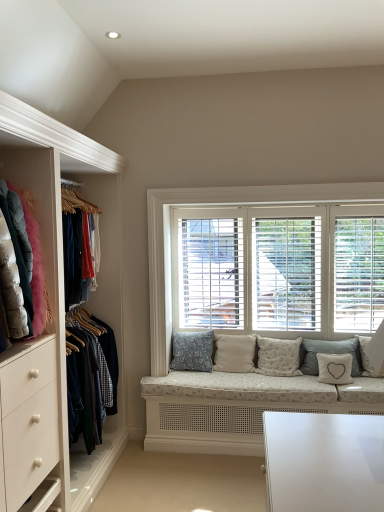
Find the location of `blue textured cushion at center, the first pillow when ordered from left to right`. blue textured cushion at center, the first pillow when ordered from left to right is located at coordinates (192, 351).

The image size is (384, 512). What do you see at coordinates (34, 262) in the screenshot?
I see `velvet jackets at left` at bounding box center [34, 262].

Measure the distance between point (318, 349) and camera.

3.45 meters.

This screenshot has height=512, width=384. What do you see at coordinates (330, 353) in the screenshot? I see `light gray fabric pillow at center, the fifth pillow in the left-to-right sequence` at bounding box center [330, 353].

What do you see at coordinates (335, 368) in the screenshot?
I see `white fabric pillow with heart design at lower right, the third pillow from the right` at bounding box center [335, 368].

You are a GUI agent. You are given a task and a screenshot of the screen. Output one action in this format:
    pyautogui.click(x=<x>, y=<y>)
    Task: Click on the blue textured cushion at center, the first pillow when ordered from left to right
    Image resolution: width=384 pixels, height=512 pixels.
    Given the screenshot: What is the action you would take?
    point(192,351)

Measure the distance between velvet jackets at left and white wood blinds at center.

velvet jackets at left and white wood blinds at center are 1.50 meters apart from each other.

In terms of size, does velvet jackets at left appear bigger or smaller than white wood blinds at center?

In the image, velvet jackets at left appears to be larger than white wood blinds at center.

Can you see velvet jackets at left touching white wood blinds at center?

There is a gap between velvet jackets at left and white wood blinds at center.

Locate an element on the screen. The height and width of the screenshot is (512, 384). the 2nd pillow counting from the right of the velvet jackets at left is located at coordinates (234, 353).

Is beige fabric cushion at center, which is the fifth pillow from right to left, to the left or to the right of velvet jackets at left in the image?

In the image, beige fabric cushion at center, which is the fifth pillow from right to left, appears on the right side of velvet jackets at left.

Consider the image. Considering the sizes of beige fabric cushion at center, which is the fifth pillow from right to left, and velvet jackets at left in the image, is beige fabric cushion at center, which is the fifth pillow from right to left, bigger or smaller than velvet jackets at left?

Considering their sizes, beige fabric cushion at center, which is the fifth pillow from right to left, takes up less space than velvet jackets at left.

Considering the relative sizes of beige fabric cushion at center, acting as the 2th pillow starting from the left, and velvet jackets at left in the image provided, is beige fabric cushion at center, acting as the 2th pillow starting from the left, taller than velvet jackets at left?

Incorrect, the height of beige fabric cushion at center, acting as the 2th pillow starting from the left, is not larger of that of velvet jackets at left.

Is velvet jackets at left inside fluffy white pillow at center, the fourth pillow from the right?

No, velvet jackets at left is located outside of fluffy white pillow at center, the fourth pillow from the right.

Is fluffy white pillow at center, which is counted as the 3th pillow, starting from the left, oriented towards velvet jackets at left?

No.

Based on the photo, can you confirm if fluffy white pillow at center, which is counted as the 3th pillow, starting from the left, is bigger than velvet jackets at left?

No.

Does point (282, 367) appear closer or farther from the camera than point (178, 333)?

Point (282, 367).

From a real-world perspective, is fluffy white pillow at center, the fourth pillow from the right, located beneath blue textured cushion at center, the first pillow when ordered from left to right?

Yes, from a real-world perspective, fluffy white pillow at center, the fourth pillow from the right, is beneath blue textured cushion at center, the first pillow when ordered from left to right.

In the scene shown: Which object is positioned more to the right, fluffy white pillow at center, which is counted as the 3th pillow, starting from the left, or blue textured cushion at center, marked as the sixth pillow in a right-to-left arrangement?

fluffy white pillow at center, which is counted as the 3th pillow, starting from the left.

How distant is fluffy white pillow at center, which is counted as the 3th pillow, starting from the left, from blue textured cushion at center, the first pillow when ordered from left to right?

The distance of fluffy white pillow at center, which is counted as the 3th pillow, starting from the left, from blue textured cushion at center, the first pillow when ordered from left to right, is 21.84 inches.

Is white fabric pillow with heart design at lower right, the third pillow from the right, positioned far away from fluffy white pillow at center, the 1th pillow from the right?

No.

How much distance is there between white fabric pillow with heart design at lower right, which ranks as the fourth pillow in left-to-right order, and fluffy white pillow at center, which appears as the sixth pillow when viewed from the left?

12.98 inches.

Can we say white fabric pillow with heart design at lower right, the third pillow from the right, lies outside fluffy white pillow at center, the 1th pillow from the right?

Indeed, white fabric pillow with heart design at lower right, the third pillow from the right, is completely outside fluffy white pillow at center, the 1th pillow from the right.

From the image's perspective, between white fabric pillow with heart design at lower right, the third pillow from the right, and fluffy white pillow at center, the 1th pillow from the right, who is located below?

white fabric pillow with heart design at lower right, the third pillow from the right, is shown below in the image.

From the image's perspective, is velvet jackets at left positioned above or below beige fabric cushion at center, acting as the 2th pillow starting from the left?

velvet jackets at left is situated higher than beige fabric cushion at center, acting as the 2th pillow starting from the left, in the image.

Locate an element on the screen. The image size is (384, 512). clothing located in front of the beige fabric cushion at center, acting as the 2th pillow starting from the left is located at coordinates (34, 262).

Does point (41, 306) come closer to viewer compared to point (238, 345)?

Yes, it is in front of point (238, 345).

Does velvet jackets at left have a greater height compared to beige fabric cushion at center, acting as the 2th pillow starting from the left?

Correct, velvet jackets at left is much taller as beige fabric cushion at center, acting as the 2th pillow starting from the left.

Locate an element on the screen. Image resolution: width=384 pixels, height=512 pixels. the 1st pillow below the light gray fabric pillow at center, the fifth pillow in the left-to-right sequence (from the image's perspective) is located at coordinates (234, 353).

How many degrees apart are the facing directions of light gray fabric pillow at center, which is counted as the second pillow, starting from the right, and beige fabric cushion at center, acting as the 2th pillow starting from the left?

1.98 degrees.

From a real-world perspective, is light gray fabric pillow at center, which is counted as the second pillow, starting from the right, on beige fabric cushion at center, acting as the 2th pillow starting from the left?

Yes, from a real-world perspective, light gray fabric pillow at center, which is counted as the second pillow, starting from the right, is over beige fabric cushion at center, acting as the 2th pillow starting from the left

Consider the image. Which of these two, light gray fabric pillow at center, the fifth pillow in the left-to-right sequence, or beige fabric cushion at center, acting as the 2th pillow starting from the left, is wider?

beige fabric cushion at center, acting as the 2th pillow starting from the left, is wider.

At what (x,y) coordinates should I click in order to perform the action: click on clothing above the white wood blinds at center (from a real-world perspective). Please return your answer as a coordinate pair (x, y). The height and width of the screenshot is (512, 384). Looking at the image, I should click on (34, 262).

Locate an element on the screen. clothing in front of the beige fabric cushion at center, acting as the 2th pillow starting from the left is located at coordinates (34, 262).

Estimate the real-world distances between objects in this image. Which object is closer to white fabric pillow with heart design at lower right, the third pillow from the right, beige fabric cushion at center, acting as the 2th pillow starting from the left, or fluffy white pillow at center, the fourth pillow from the right?

fluffy white pillow at center, the fourth pillow from the right.

Which object lies nearer to the anchor point beige fabric cushion at center, which is the fifth pillow from right to left, fluffy white pillow at center, the fourth pillow from the right, or velvet jackets at left?

Based on the image, fluffy white pillow at center, the fourth pillow from the right, appears to be nearer to beige fabric cushion at center, which is the fifth pillow from right to left.

Which object lies nearer to the anchor point fluffy white pillow at center, which is counted as the 3th pillow, starting from the left, beige fabric cushion at center, acting as the 2th pillow starting from the left, or white wood blinds at center?

Among the two, beige fabric cushion at center, acting as the 2th pillow starting from the left, is located nearer to fluffy white pillow at center, which is counted as the 3th pillow, starting from the left.

Which object lies nearer to the anchor point velvet jackets at left, white fabric pillow with heart design at lower right, which ranks as the fourth pillow in left-to-right order, or white wood blinds at center?

Among the two, white wood blinds at center is located nearer to velvet jackets at left.

From the image, which object appears to be nearer to blue textured cushion at center, marked as the sixth pillow in a right-to-left arrangement, white wood blinds at center or white fabric pillow with heart design at lower right, which ranks as the fourth pillow in left-to-right order?

Based on the image, white wood blinds at center appears to be nearer to blue textured cushion at center, marked as the sixth pillow in a right-to-left arrangement.

Estimate the real-world distances between objects in this image. Which object is closer to beige fabric cushion at center, which is the fifth pillow from right to left, fluffy white pillow at center, the fourth pillow from the right, or fluffy white pillow at center, which appears as the sixth pillow when viewed from the left?

fluffy white pillow at center, the fourth pillow from the right.

Looking at the image, which one is located further to fluffy white pillow at center, which appears as the sixth pillow when viewed from the left, white wood blinds at center or velvet jackets at left?

velvet jackets at left is positioned further to the anchor fluffy white pillow at center, which appears as the sixth pillow when viewed from the left.

Looking at the image, which one is located closer to white wood blinds at center, white fabric pillow with heart design at lower right, which ranks as the fourth pillow in left-to-right order, or fluffy white pillow at center, which appears as the sixth pillow when viewed from the left?

white fabric pillow with heart design at lower right, which ranks as the fourth pillow in left-to-right order.

The image size is (384, 512). I want to click on window situated between blue textured cushion at center, marked as the sixth pillow in a right-to-left arrangement, and fluffy white pillow at center, which is counted as the 3th pillow, starting from the left, from left to right, so click(x=219, y=205).

You are a GUI agent. You are given a task and a screenshot of the screen. Output one action in this format:
    pyautogui.click(x=<x>, y=<y>)
    Task: Click on the window between blue textured cushion at center, marked as the sixth pillow in a right-to-left arrangement, and light gray fabric pillow at center, which is counted as the second pillow, starting from the right, in the horizontal direction
    The image size is (384, 512).
    Given the screenshot: What is the action you would take?
    pyautogui.click(x=219, y=205)

Locate an element on the screen. The height and width of the screenshot is (512, 384). pillow between blue textured cushion at center, the first pillow when ordered from left to right, and fluffy white pillow at center, the fourth pillow from the right, from left to right is located at coordinates (234, 353).

Identify the location of pillow situated between white fabric pillow with heart design at lower right, the third pillow from the right, and fluffy white pillow at center, which appears as the sixth pillow when viewed from the left, from left to right. The image size is (384, 512). (330, 353).